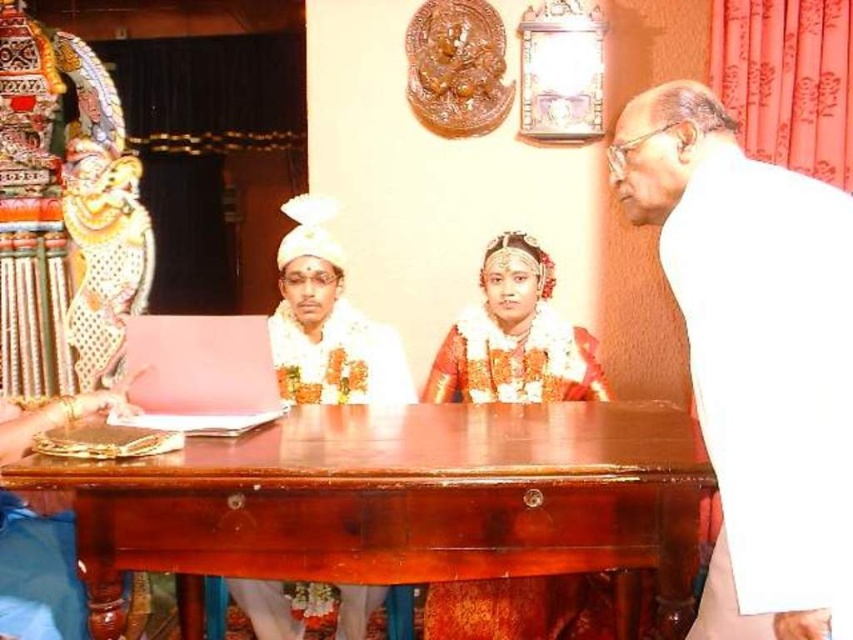
Question: Which point is closer to the camera?

Choices:
 (A) (349, 625)
 (B) (440, 636)
 (C) (198, 460)
 (D) (769, 579)

Answer: (D)

Question: Is golden textured saree at center closer to camera compared to white satin robe at center?

Choices:
 (A) no
 (B) yes

Answer: (A)

Question: Where is mahogany wood table at center located in relation to white satin robe at center in the image?

Choices:
 (A) above
 (B) below

Answer: (B)

Question: Among these points, which one is farthest from the camera?

Choices:
 (A) (306, 458)
 (B) (279, 385)
 (C) (447, 618)

Answer: (B)

Question: Which point is closer to the camera taking this photo?

Choices:
 (A) click(x=343, y=326)
 (B) click(x=515, y=392)
 (C) click(x=822, y=486)
 (D) click(x=508, y=404)

Answer: (C)

Question: Is golden textured saree at center bigger than white satin robe at center?

Choices:
 (A) yes
 (B) no

Answer: (A)